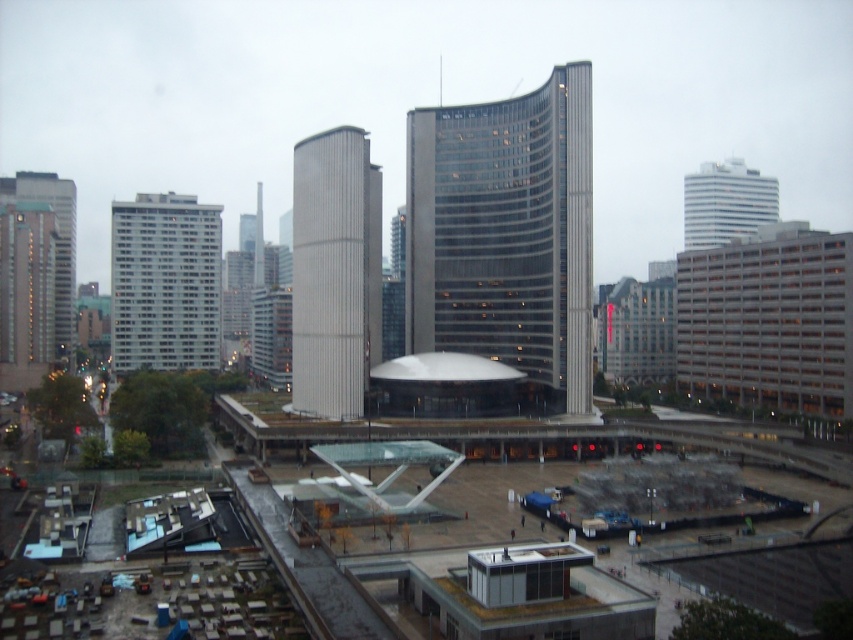
Does point (433, 208) come behind point (712, 198)?

No, (433, 208) is closer to viewer.

Who is higher up, glassy steel tower at center or white glossy building at upper right?

Positioned higher is white glossy building at upper right.

Does point (561, 216) lie behind point (689, 209)?

No.

You are a GUI agent. You are given a task and a screenshot of the screen. Output one action in this format:
    pyautogui.click(x=<x>, y=<y>)
    Task: Click on the glassy steel tower at center
    The height and width of the screenshot is (640, 853).
    Given the screenshot: What is the action you would take?
    pyautogui.click(x=505, y=232)

Is concrete construction site at lower left wider than smooth gray tower at center?

Indeed, concrete construction site at lower left has a greater width compared to smooth gray tower at center.

Can you confirm if concrete construction site at lower left is positioned below smooth gray tower at center?

Correct, concrete construction site at lower left is located below smooth gray tower at center.

This screenshot has height=640, width=853. What do you see at coordinates (432, 588) in the screenshot?
I see `concrete construction site at lower left` at bounding box center [432, 588].

Locate an element on the screen. concrete construction site at lower left is located at coordinates (432, 588).

Can you confirm if concrete construction site at lower left is positioned above white glossy building at left?

No.

Who is more distant from viewer, (x=427, y=595) or (x=171, y=234)?

Point (x=171, y=234)

I want to click on concrete construction site at lower left, so click(x=432, y=588).